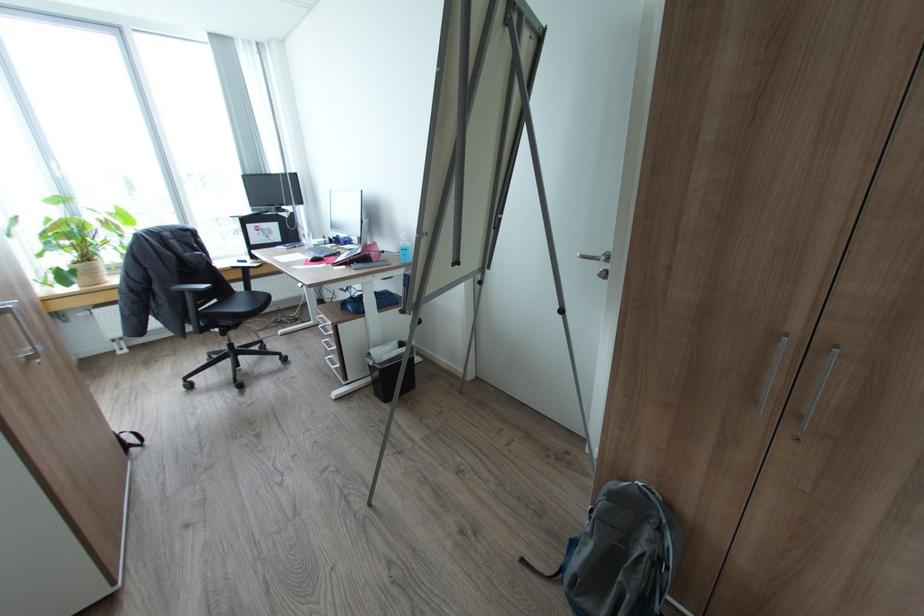
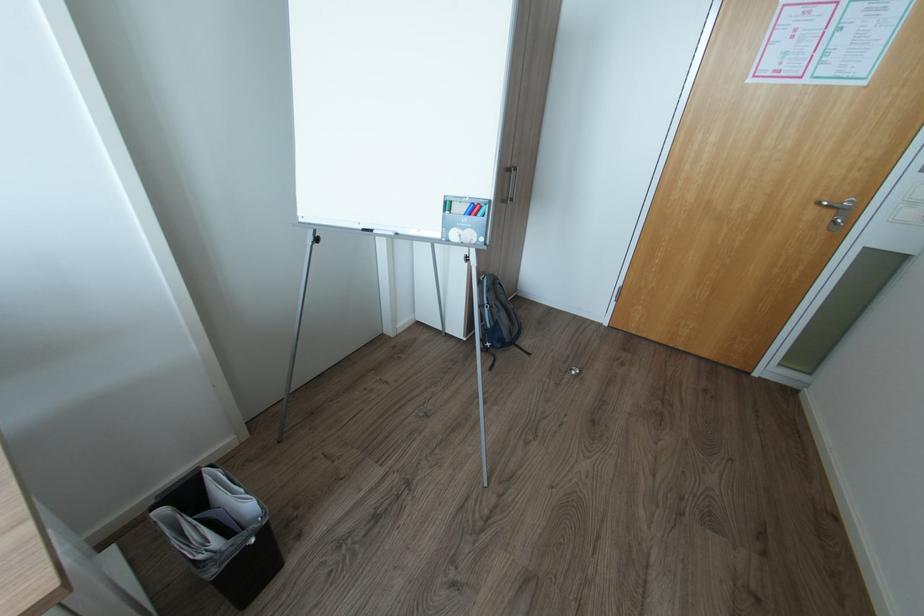
In the second image, find the point that corresponds to (x=374, y=363) in the first image.

(257, 541)